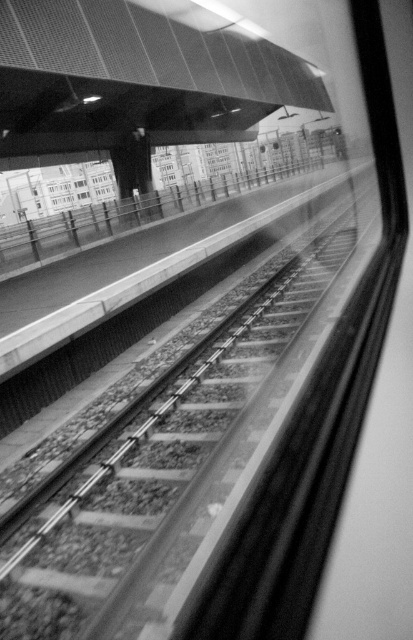
From the picture: Who is more forward, (x=80, y=195) or (x=78, y=182)?

Point (x=78, y=182) is in front.

You are a GUI agent. You are given a task and a screenshot of the screen. Output one action in this format:
    pyautogui.click(x=<x>, y=<y>)
    Task: Click on the transparent glass window at center
    
    Given the screenshot: What is the action you would take?
    pyautogui.click(x=83, y=195)

What are the coordinates of `transparent glass window at center` in the screenshot? It's located at (83, 195).